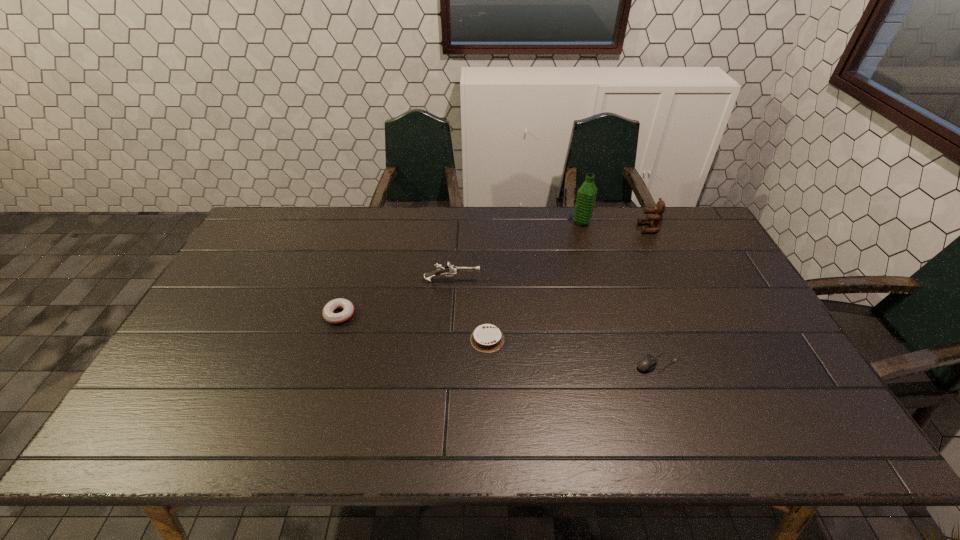
I want to click on vacant space located on the face of the rightmost object, so click(545, 228).

What are the coordinates of `vacant space situated 0.260m on the face of the rightmost object` in the screenshot? It's located at [x=565, y=228].

Identify the location of vacant area situated on the face of the rightmost object. The height and width of the screenshot is (540, 960). (599, 228).

Locate an element on the screen. vacant space situated 0.290m aimed along the barrel of the third tallest object is located at coordinates 574,280.

Where is `vacant space situated 0.220m on the front of the leftmost object`? The height and width of the screenshot is (540, 960). vacant space situated 0.220m on the front of the leftmost object is located at coordinates (314, 396).

Where is `blank space located on the back of the chocolate cake`? This screenshot has height=540, width=960. blank space located on the back of the chocolate cake is located at coordinates (487, 277).

Find the location of a particular element. This screenshot has height=540, width=960. vacant region located 0.160m on the left of the mouse is located at coordinates (572, 363).

The height and width of the screenshot is (540, 960). I want to click on water bottle present at the far edge, so click(585, 201).

Locate an element on the screen. teddy bear positioned at the far edge is located at coordinates (655, 221).

Find the location of a particular element. The width and height of the screenshot is (960, 540). vacant area at the far edge of the desktop is located at coordinates (433, 217).